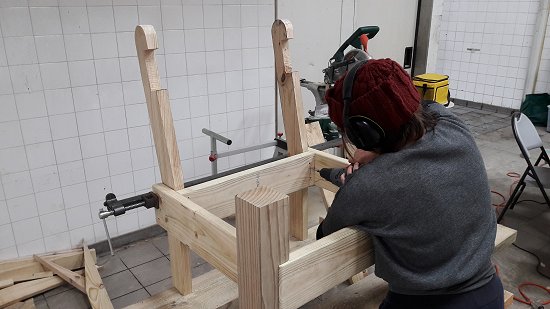
I want to click on gray tile, so click(x=140, y=266).